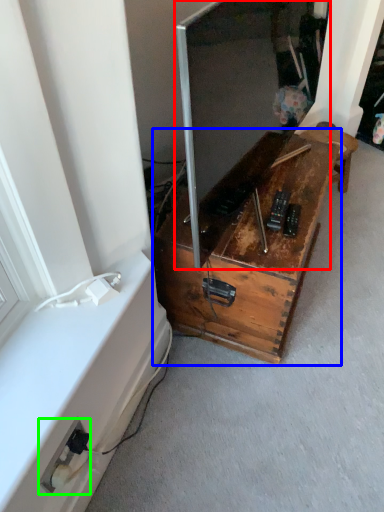
Question: Considering the real-world distances, which object is farthest from window screen (highlighted by a red box)? furniture (highlighted by a blue box) or electric outlet (highlighted by a green box)?

Choices:
 (A) furniture
 (B) electric outlet

Answer: (B)